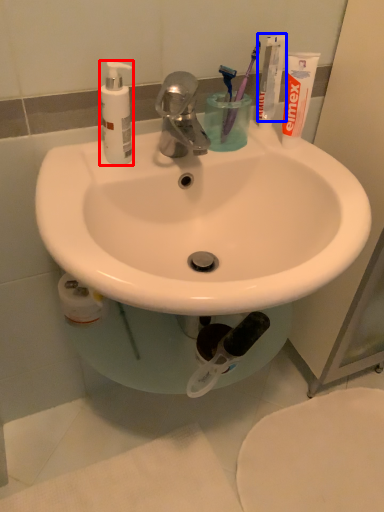
Question: Which object appears farthest to the camera in this image, soap dispenser (highlighted by a red box) or toothpaste (highlighted by a blue box)?

Choices:
 (A) soap dispenser
 (B) toothpaste

Answer: (B)